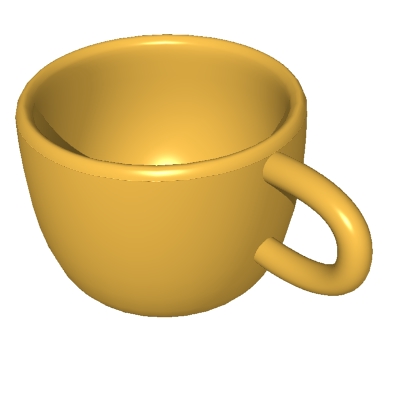
I want to click on bottom of cup, so click(x=197, y=306).